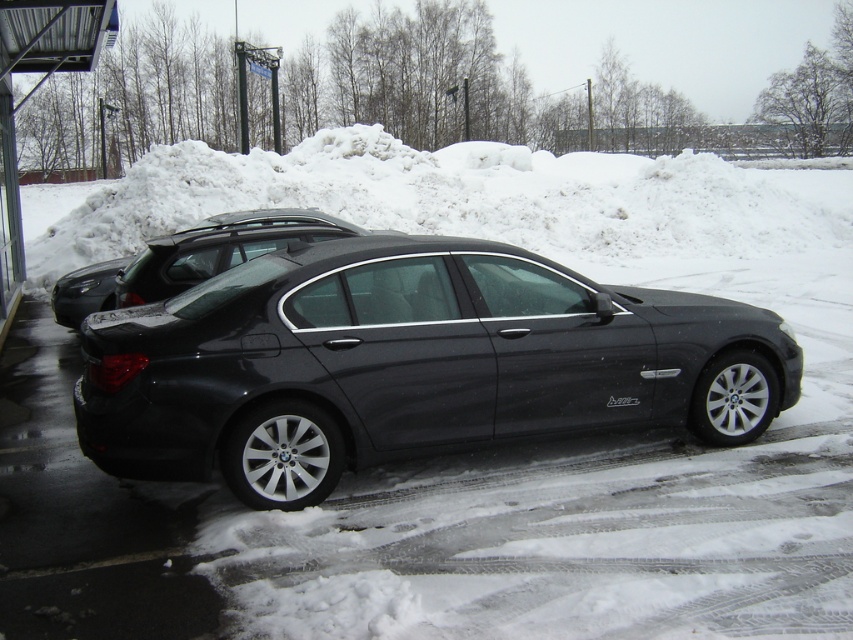
Is satin black car at center in front of metallic silver bus stop at left?

Yes, it is.

Does satin black car at center have a lesser height compared to metallic silver bus stop at left?

Correct, satin black car at center is not as tall as metallic silver bus stop at left.

Who is more distant from viewer, (x=219, y=214) or (x=20, y=104)?

Positioned behind is point (x=219, y=214).

At what (x,y) coordinates should I click in order to perform the action: click on satin black car at center. Please return your answer as a coordinate pair (x, y). The image size is (853, 640). Looking at the image, I should click on (189, 259).

Can you confirm if satin black sedan at center is positioned below metallic silver bus stop at left?

Yes, satin black sedan at center is below metallic silver bus stop at left.

Where is `satin black sedan at center`? The width and height of the screenshot is (853, 640). satin black sedan at center is located at coordinates (409, 364).

Looking at this image, can you confirm if satin black sedan at center is positioned to the left of satin black car at center?

No, satin black sedan at center is not to the left of satin black car at center.

Which is behind, point (633, 316) or point (154, 241)?

The point (154, 241) is behind.

Locate an element on the screen. Image resolution: width=853 pixels, height=640 pixels. satin black sedan at center is located at coordinates (409, 364).